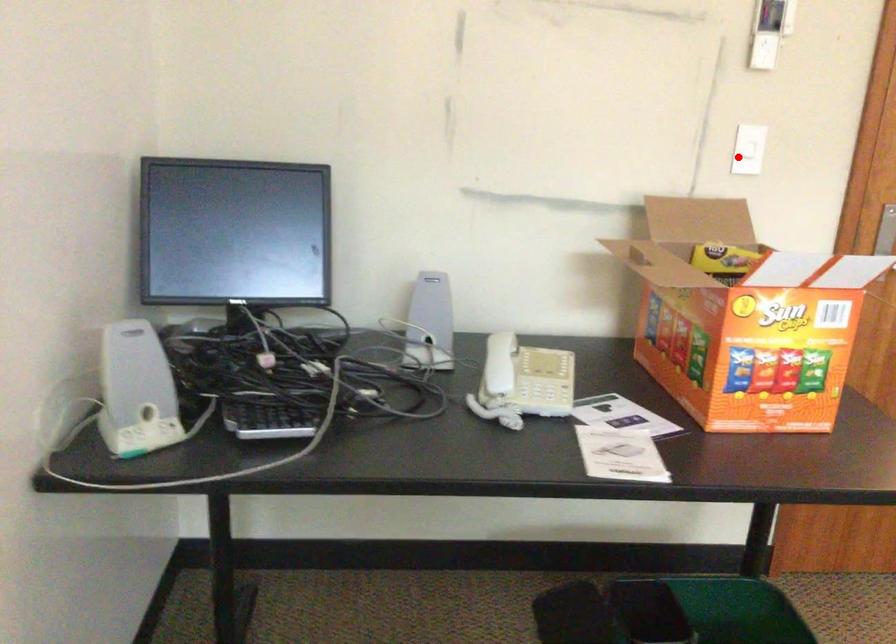
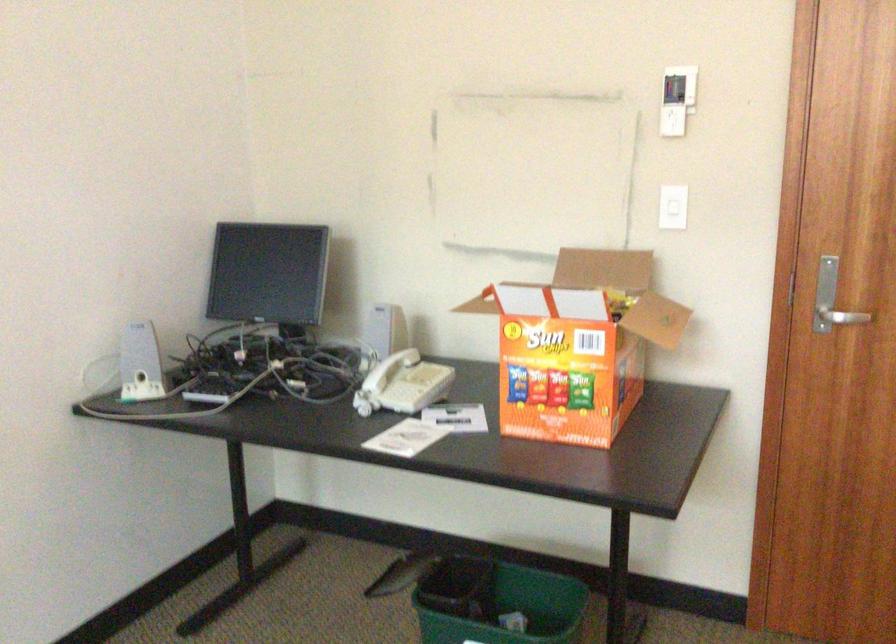
Locate, in the second image, the point that corresponds to the highlighted location in the first image.

(672, 214)